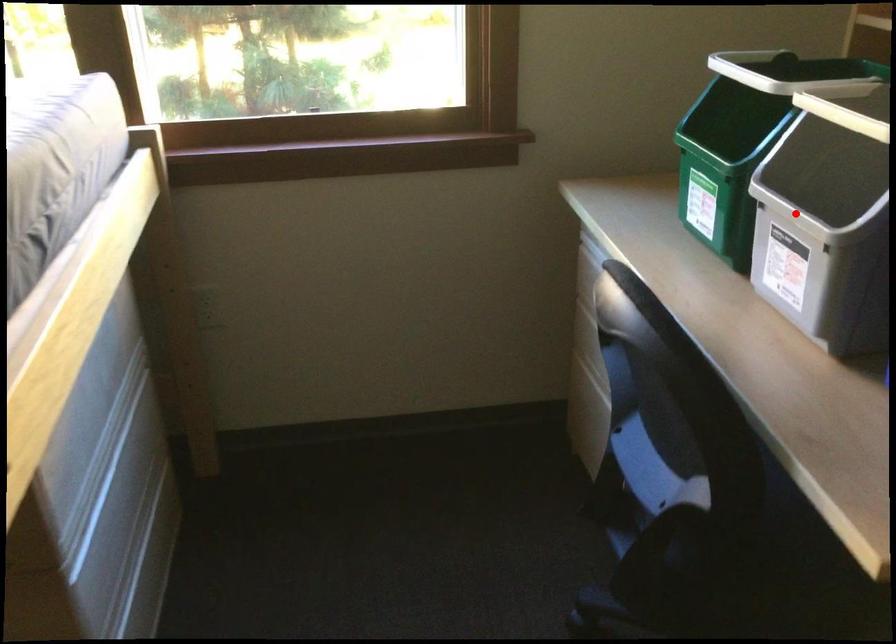
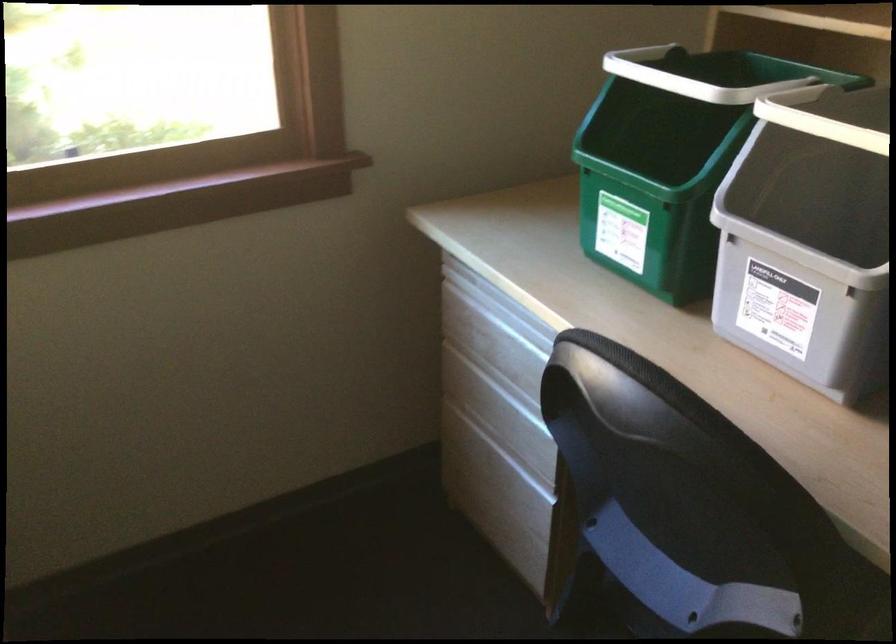
Question: I am providing you with two images of the same scene from different viewpoints. In image1, a red point is highlighted. Considering the same 3D point in image2, which of the following is correct?

Choices:
 (A) It is closer
 (B) It is farther

Answer: (A)